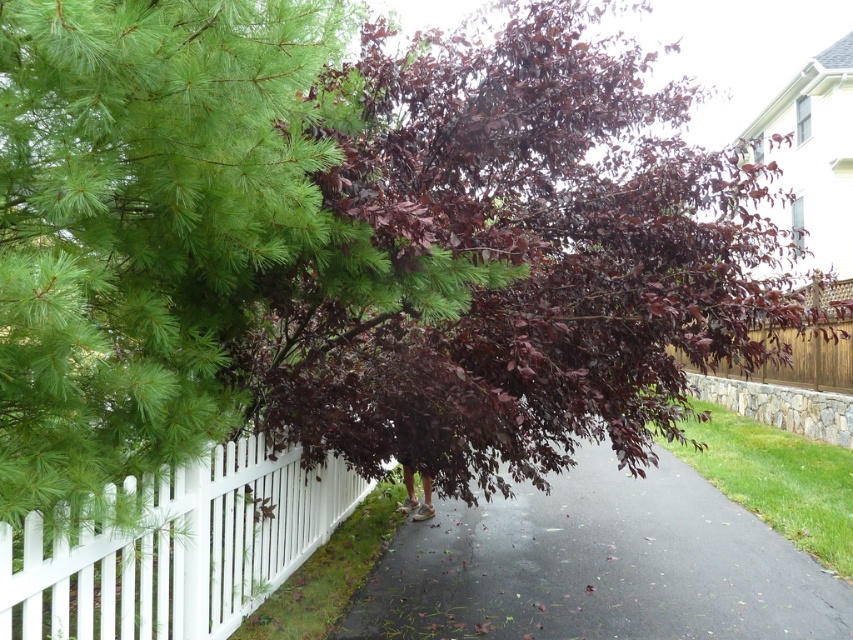
Question: Is dark purple leafy tree at center thinner than black asphalt pavement at center?

Choices:
 (A) yes
 (B) no

Answer: (B)

Question: Considering the real-world distances, which object is closest to the dark purple leafy tree at center?

Choices:
 (A) white wooden fence at center
 (B) black asphalt pavement at center

Answer: (A)

Question: Does black asphalt pavement at center appear over white wooden fence at center?

Choices:
 (A) no
 (B) yes

Answer: (A)

Question: Can you confirm if black asphalt pavement at center is wider than white wooden fence at center?

Choices:
 (A) no
 (B) yes

Answer: (B)

Question: Which of these objects is positioned farthest from the white wooden fence at center?

Choices:
 (A) dark purple leafy tree at center
 (B) black asphalt pavement at center

Answer: (B)

Question: Which point appears farthest from the camera in this image?

Choices:
 (A) (288, 509)
 (B) (596, 365)
 (C) (733, 566)

Answer: (C)